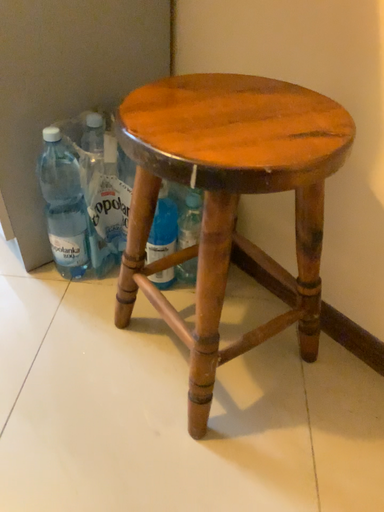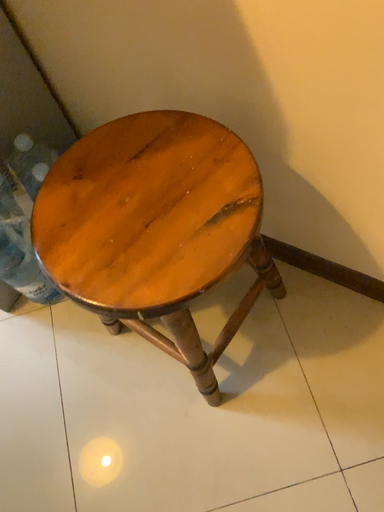
Question: Which way did the camera rotate in the video?

Choices:
 (A) rotated upward
 (B) rotated downward

Answer: (B)